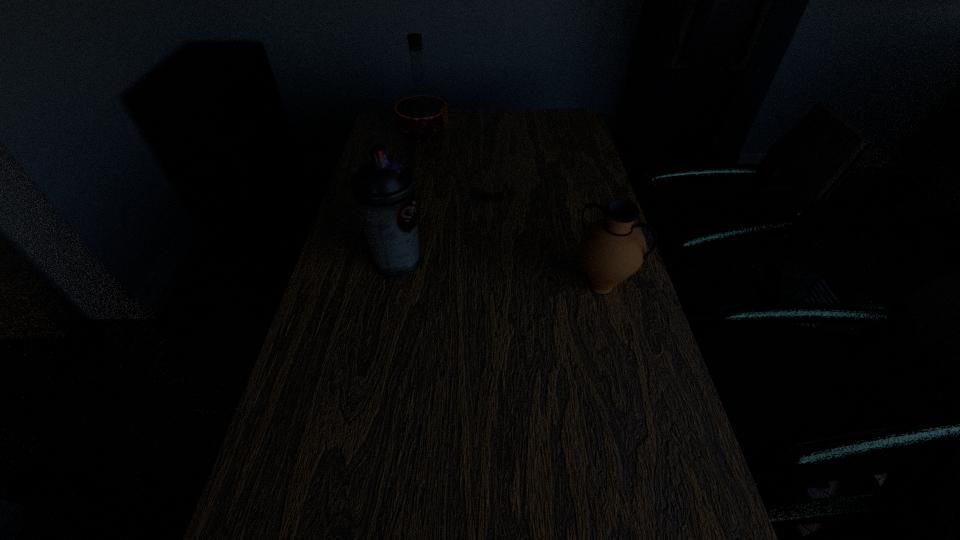
Locate an element on the screen. The width and height of the screenshot is (960, 540). the closest object to the farthest object is located at coordinates (498, 196).

This screenshot has width=960, height=540. I want to click on vacant area in the image that satisfies the following two spatial constraints: 1. on the front label of the farthest object; 2. on the back side of the second shortest object, so click(x=396, y=287).

You are a GUI agent. You are given a task and a screenshot of the screen. Output one action in this format:
    pyautogui.click(x=<x>, y=<y>)
    Task: Click on the free spot that satisfies the following two spatial constraints: 1. on the front label of the rightmost object; 2. on the left side of the farthest object
    The width and height of the screenshot is (960, 540).
    Given the screenshot: What is the action you would take?
    tap(396, 287)

Locate an element on the screen. vacant space that satisfies the following two spatial constraints: 1. on the front label of the liquor; 2. on the right side of the third tallest object is located at coordinates (396, 287).

Where is `free point that satisfies the following two spatial constraints: 1. on the front label of the third tallest object; 2. on the left side of the liquor`? free point that satisfies the following two spatial constraints: 1. on the front label of the third tallest object; 2. on the left side of the liquor is located at coordinates (396, 287).

Where is `vacant space that satisfies the following two spatial constraints: 1. on the front side of the aerosol can; 2. on the right side of the second shortest object`? This screenshot has height=540, width=960. vacant space that satisfies the following two spatial constraints: 1. on the front side of the aerosol can; 2. on the right side of the second shortest object is located at coordinates (394, 287).

The height and width of the screenshot is (540, 960). I want to click on free space that satisfies the following two spatial constraints: 1. on the front label of the liquor; 2. on the front side of the aerosol can, so click(401, 262).

Image resolution: width=960 pixels, height=540 pixels. What are the coordinates of `vacant space that satisfies the following two spatial constraints: 1. on the back side of the pitcher; 2. on the front label of the liquor` in the screenshot? It's located at (562, 134).